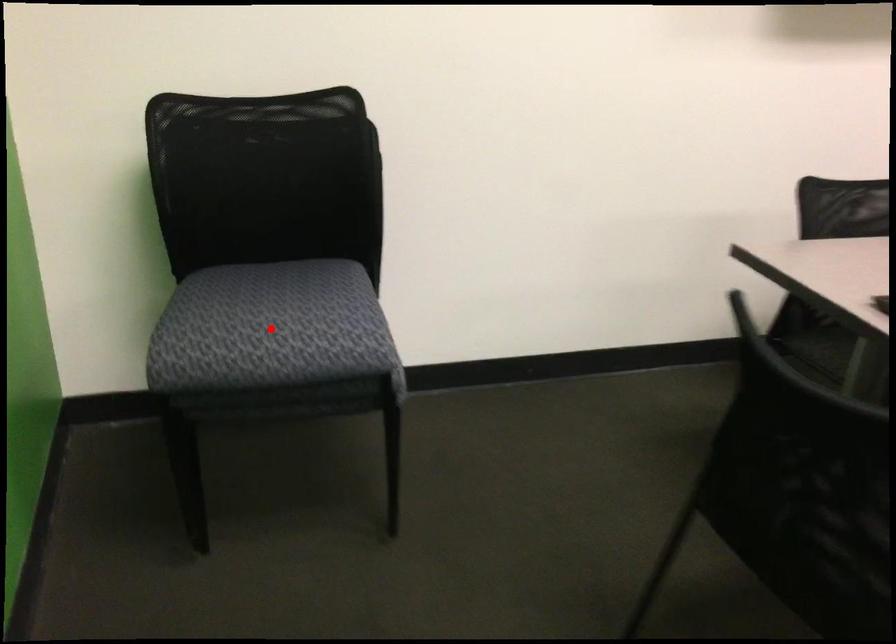
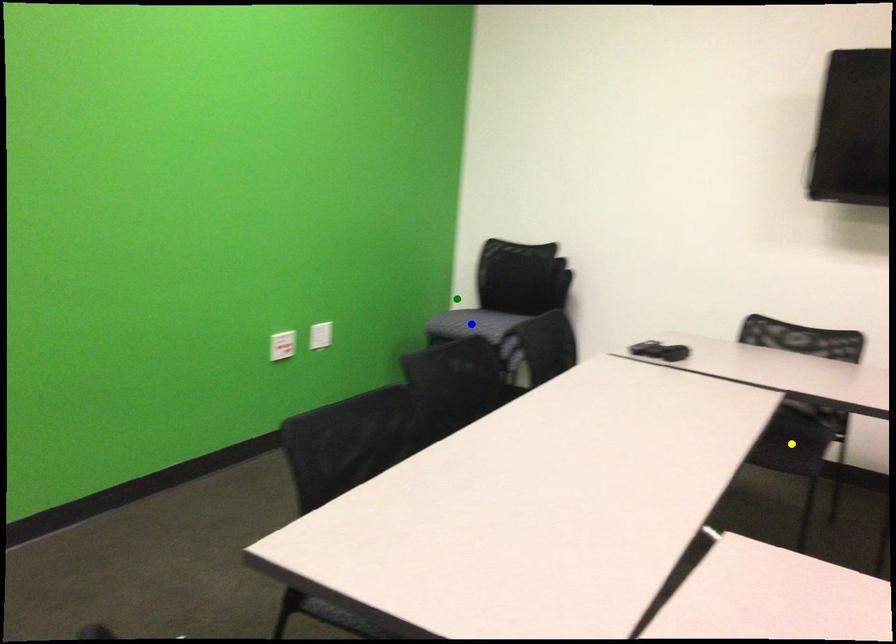
Question: I am providing you with two images of the same scene from different viewpoints. A red point is marked on the first image. You are given multiple points on the second image. Which point in image 2 is actually the same real-world point as the red point in image 1?

Choices:
 (A) yellow point
 (B) green point
 (C) blue point

Answer: (B)